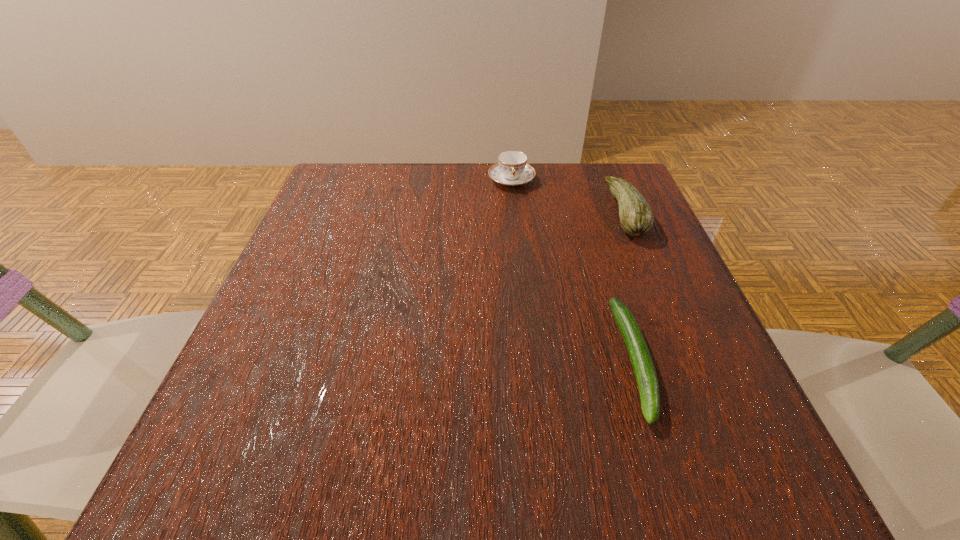
Where is `the rightmost object`? This screenshot has height=540, width=960. the rightmost object is located at coordinates (636, 217).

I want to click on the right zucchini, so click(636, 217).

The height and width of the screenshot is (540, 960). Find the location of `teacup`. teacup is located at coordinates (512, 169).

Identify the location of the nearer zucchini. (640, 357).

Where is `the nearest object`? Image resolution: width=960 pixels, height=540 pixels. the nearest object is located at coordinates (640, 357).

Where is `vacant point located 0.240m at the stem end of the taller zucchini`? vacant point located 0.240m at the stem end of the taller zucchini is located at coordinates (503, 212).

What are the coordinates of `blank space located at the stem end of the taller zucchini` in the screenshot? It's located at (525, 212).

Image resolution: width=960 pixels, height=540 pixels. Identify the location of vacant space positioned 0.080m at the stem end of the taller zucchini. (574, 212).

The image size is (960, 540). What are the coordinates of `vacant space located 0.320m on the side with the handle of the teacup` in the screenshot? It's located at (522, 286).

Where is `vacant space located 0.050m on the front-facing side of the left zucchini`? The height and width of the screenshot is (540, 960). vacant space located 0.050m on the front-facing side of the left zucchini is located at coordinates (668, 467).